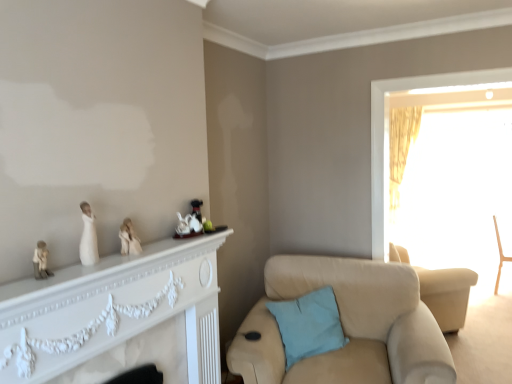
Image resolution: width=512 pixels, height=384 pixels. What are the coordinates of `free area in between white porcelain figurine at left, the 2th person from the back, and white porcelain teapot at center, which ranks as the 2th toy in left-to-right order` in the screenshot? It's located at (146, 249).